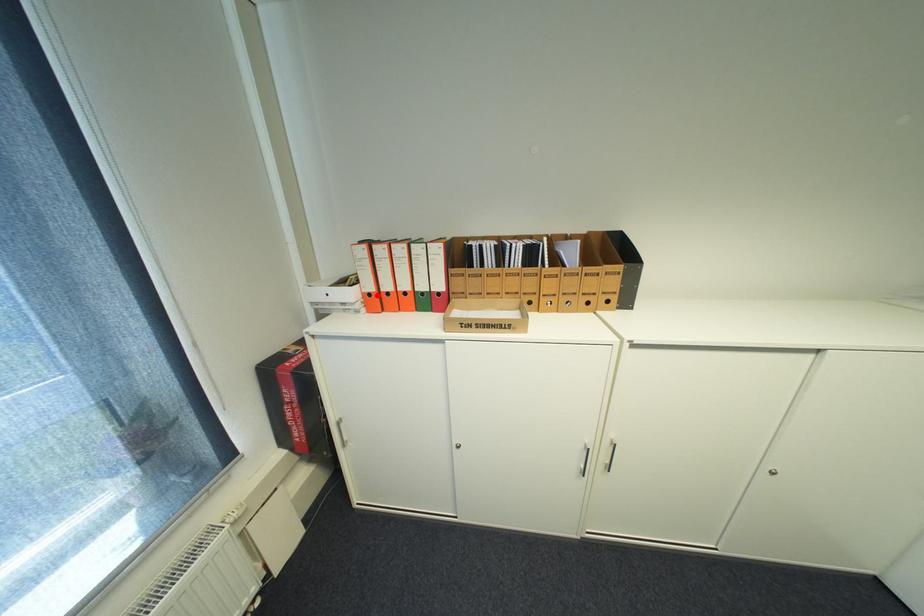
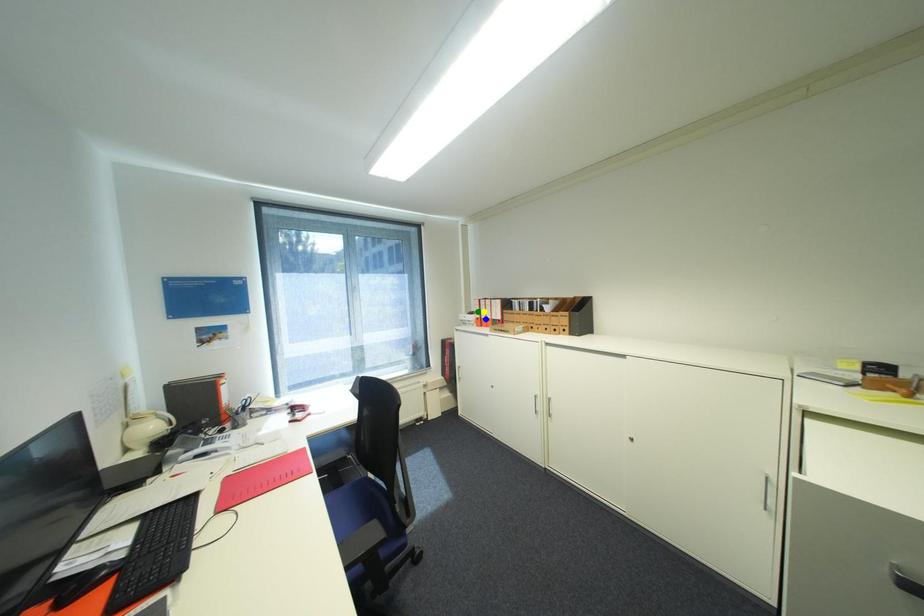
Question: I am providing you with two images of the same scene from different viewpoints. A red point is marked on the first image. You are given multiple points on the second image. Which mark in image 2 goes with the point in image 1?

Choices:
 (A) yellow point
 (B) blue point
 (C) green point

Answer: (B)